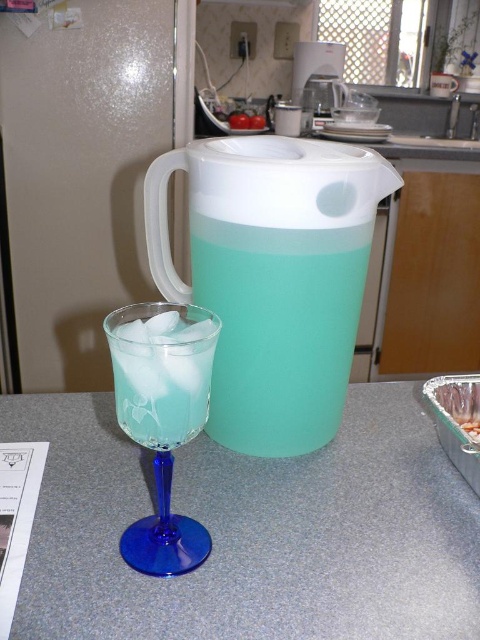
In the scene shown: Can you confirm if translucent plastic pitcher at center is wider than white plastic blender at upper center?

No.

Does translucent plastic pitcher at center have a lesser width compared to white plastic blender at upper center?

Yes.

Locate an element on the screen. This screenshot has width=480, height=640. translucent plastic pitcher at center is located at coordinates (273, 276).

Identify the location of translucent plastic pitcher at center. (273, 276).

What do you see at coordinates (252, 531) in the screenshot?
I see `matte plastic counter top at center` at bounding box center [252, 531].

Who is more distant from viewer, (379, 442) or (164, 301)?

The point (379, 442) is more distant.

Is point (460, 488) positioned after point (133, 304)?

No, (460, 488) is in front of (133, 304).

Find the location of a particular element. matte plastic counter top at center is located at coordinates (252, 531).

Is blue glass at left smaller than white plastic blender at upper center?

Correct, blue glass at left occupies less space than white plastic blender at upper center.

Between blue glass at left and white plastic blender at upper center, which one has more height?

Standing taller between the two is white plastic blender at upper center.

Locate an element on the screen. This screenshot has height=640, width=480. blue glass at left is located at coordinates (163, 417).